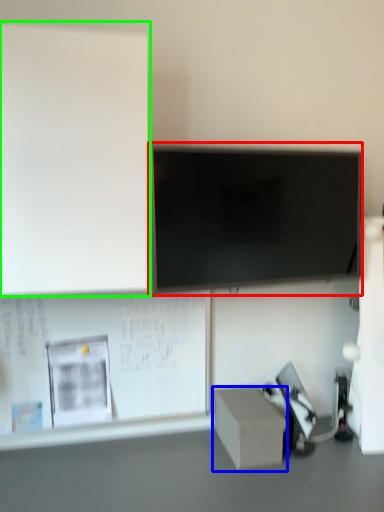
Question: Which is farther away from television (highlighted by a red box)? box (highlighted by a blue box) or bulletin board (highlighted by a green box)?

Choices:
 (A) box
 (B) bulletin board

Answer: (A)